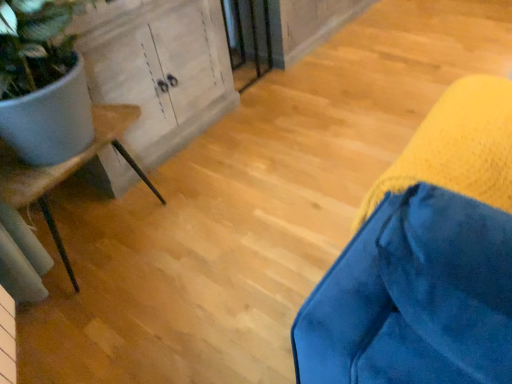
The image size is (512, 384). Find the location of `vacant area located to the right-hand side of wooden screen door at center`. vacant area located to the right-hand side of wooden screen door at center is located at coordinates (295, 78).